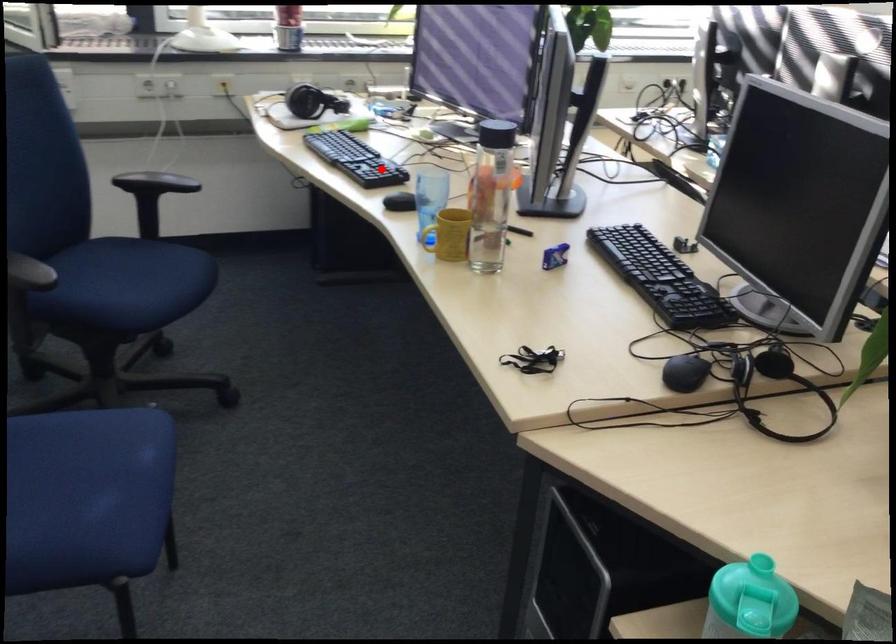
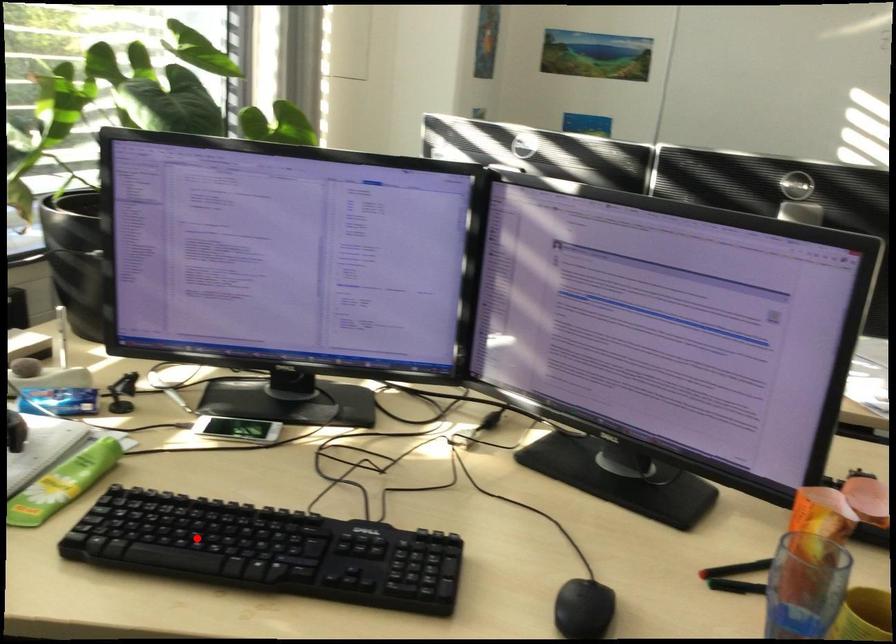
I am providing you with two images of the same scene from different viewpoints. A red point is marked on the first image and another point is marked on the second image. Is the red point in image1 aligned with the point shown in image2?

No